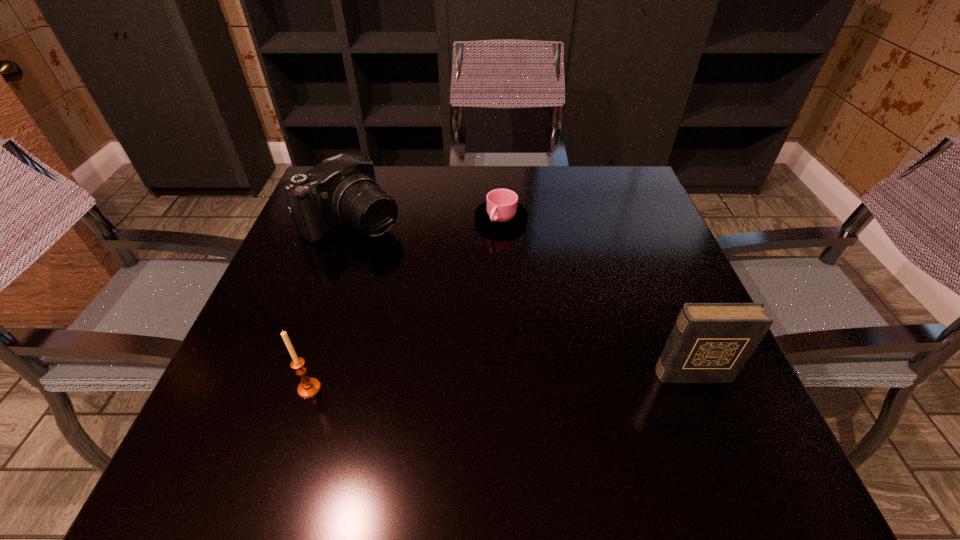
Image resolution: width=960 pixels, height=540 pixels. Identify the location of vacant region that satisfies the following two spatial constraints: 1. on the front side of the candle_holder; 2. on the right side of the camera. (295, 389).